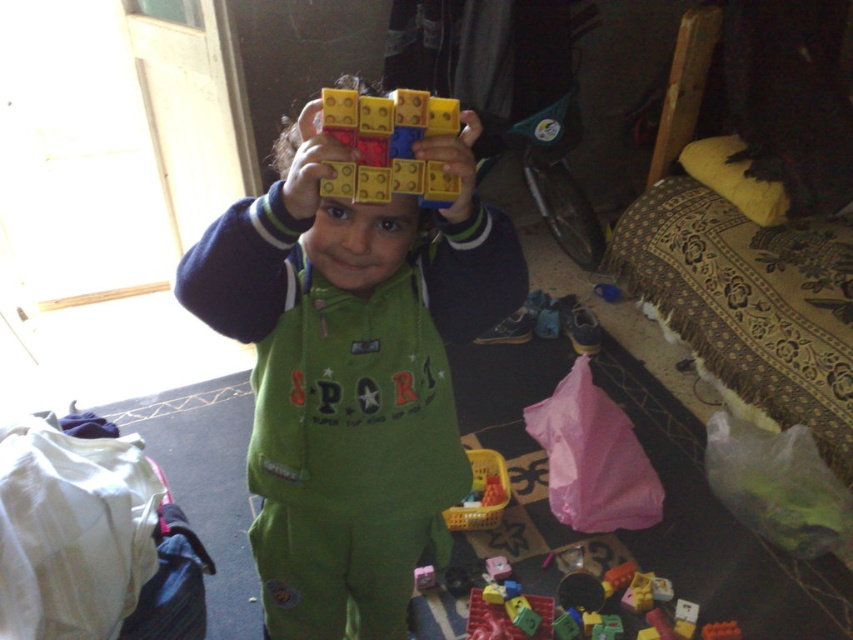
Question: Which of the following is the closest to the observer?

Choices:
 (A) matte plastic blocks at center
 (B) green matte jumpsuit at center

Answer: (A)

Question: In this image, where is green matte jumpsuit at center located relative to matte plastic blocks at center?

Choices:
 (A) above
 (B) below

Answer: (B)

Question: Is the position of green matte jumpsuit at center less distant than that of matte plastic blocks at center?

Choices:
 (A) no
 (B) yes

Answer: (A)

Question: Which point is farther to the camera?

Choices:
 (A) (412, 157)
 (B) (268, 438)

Answer: (B)

Question: Observing the image, what is the correct spatial positioning of green matte jumpsuit at center in reference to matte plastic blocks at center?

Choices:
 (A) above
 (B) below

Answer: (B)